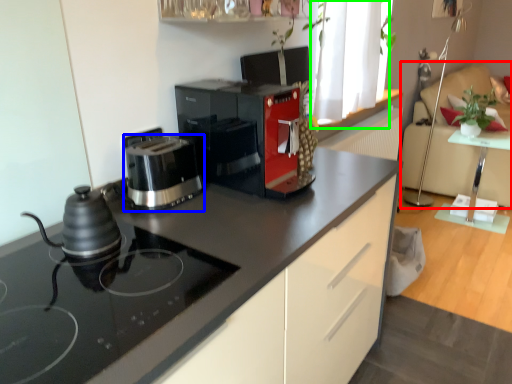
Question: Which object is positioned farthest from chair (highlighted by a red box)? Select from kitchen appliance (highlighted by a blue box) and window (highlighted by a green box).

Choices:
 (A) kitchen appliance
 (B) window

Answer: (A)